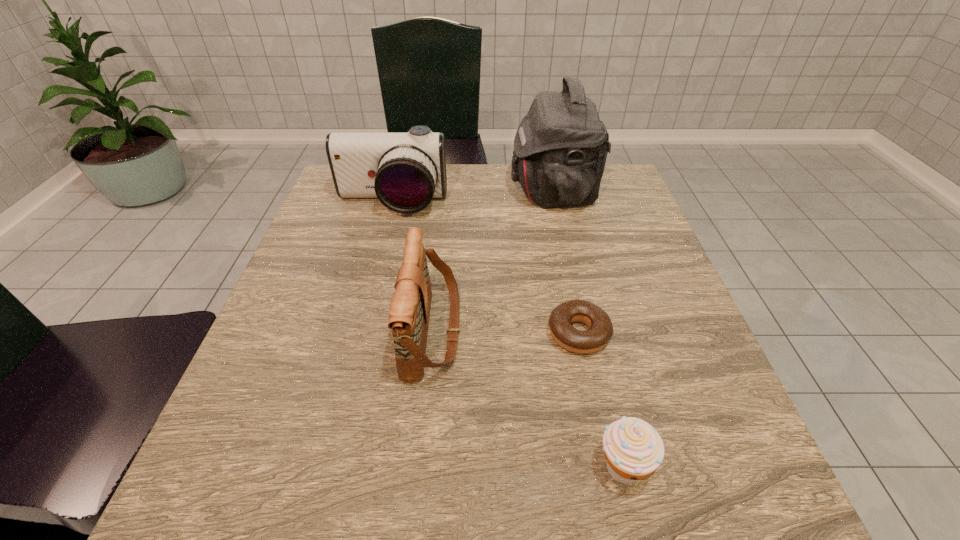
At what (x,y) coordinates should I click in order to perform the action: click on muffin that is positioned at the right edge. Please return your answer as a coordinate pair (x, y). The width and height of the screenshot is (960, 540). Looking at the image, I should click on (633, 449).

Identify the location of doughnut present at the right edge. The image size is (960, 540). (600, 331).

I want to click on object present at the far left corner, so click(x=404, y=171).

Image resolution: width=960 pixels, height=540 pixels. I want to click on object that is at the far right corner, so click(x=560, y=148).

This screenshot has width=960, height=540. Find the location of `object at the near right corner`. object at the near right corner is located at coordinates (633, 449).

In the image, there is a desktop. Find the location of `free space at the far edge`. free space at the far edge is located at coordinates (465, 181).

The image size is (960, 540). In order to click on vacant space at the left edge of the desktop in this screenshot , I will do `click(324, 226)`.

Where is `blank space at the right edge`? blank space at the right edge is located at coordinates (614, 292).

Where is `blank space at the far right corner of the desktop`? This screenshot has height=540, width=960. blank space at the far right corner of the desktop is located at coordinates (601, 189).

Locate an element on the screen. The height and width of the screenshot is (540, 960). vacant point located between the taller shoulder bag and the camcorder is located at coordinates (472, 197).